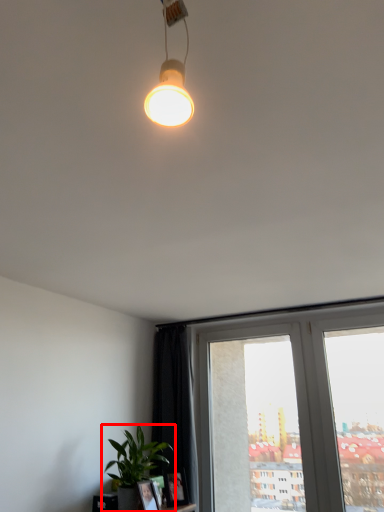
Question: From the image's perspective, considering the relative positions of houseplant (annotated by the red box) and window frame in the image provided, where is houseplant (annotated by the red box) located with respect to the staircase?

Choices:
 (A) below
 (B) above

Answer: (B)